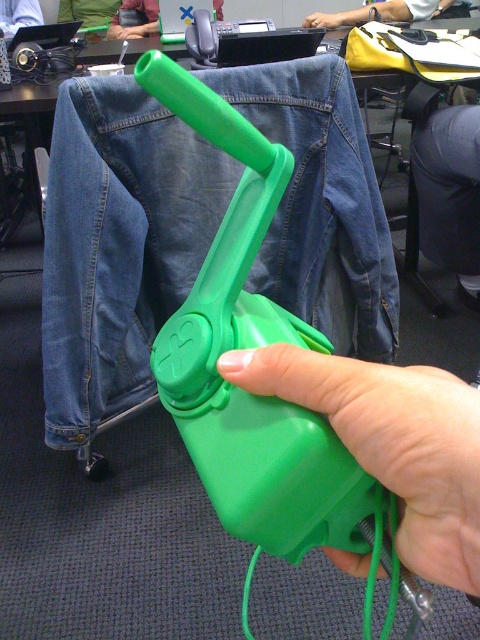
Question: Which point is closer to the camera taking this photo?

Choices:
 (A) (416, 12)
 (B) (2, 22)

Answer: (A)

Question: Among these points, which one is nearest to the camera?

Choices:
 (A) (398, 4)
 (B) (321, 17)
 (C) (122, 36)

Answer: (A)

Question: Observing the image, what is the correct spatial positioning of green matte plastic hand at center in reference to brushed metal water at bottle left?

Choices:
 (A) left
 (B) right

Answer: (B)

Question: Is brushed metal water at bottle left below green plastic hand at center?

Choices:
 (A) yes
 (B) no

Answer: (B)

Question: Estimate the real-world distances between objects in this image. Which object is closer to the green plastic hand at upper center?

Choices:
 (A) brushed metal water at bottle left
 (B) green matte plastic hand at center
 (C) brushed metal shirt at upper left

Answer: (A)

Question: Can you confirm if smooth yellow shirt at upper center is positioned below green plastic hand at upper center?

Choices:
 (A) yes
 (B) no

Answer: (B)